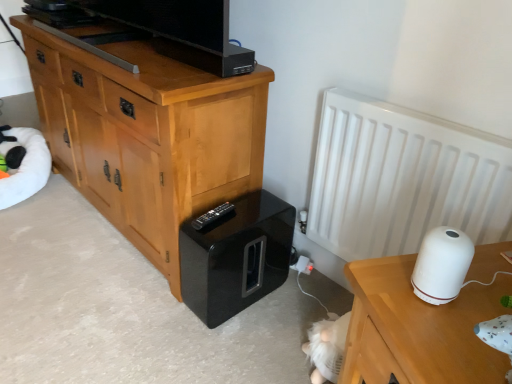
At what (x,y) coordinates should I click in order to perform the action: click on vacant space to the left of white glossy humidifier at right. Please return your answer as a coordinate pair (x, y). The height and width of the screenshot is (384, 512). Looking at the image, I should click on (383, 288).